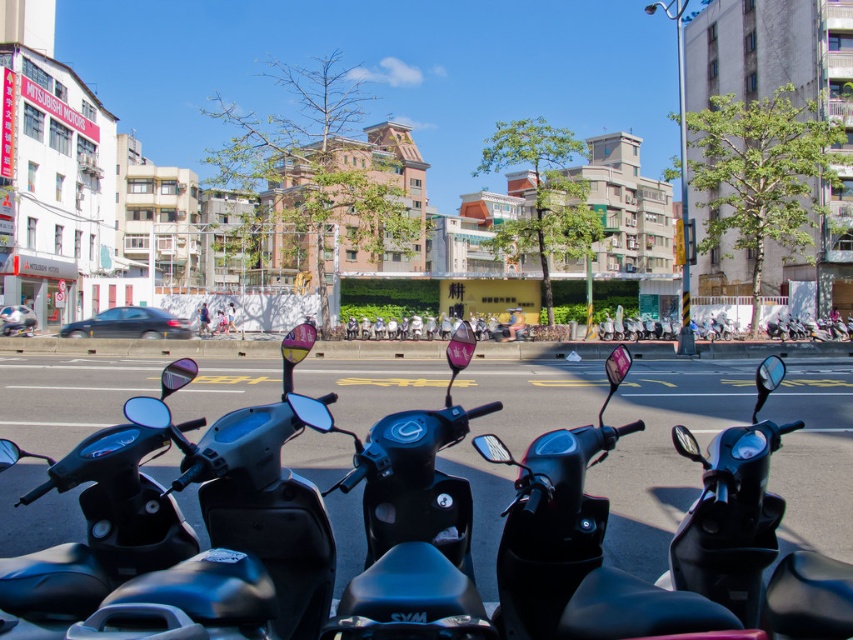
You are a delivery person needing to quickly access your vehicle. You see both the matte black motorbike at center and the black matte scooter at center. Which one is closer to you?

The matte black motorbike at center is closer to you because the black matte scooter at center is positioned behind it.

You are a delivery person who needs to park your vehicle between two scooters. You have a matte black motorbike at center and a black matte scooter at center in front of you. Which vehicle should you move to create space for your delivery van?

You should move the black matte scooter at center to the right of the matte black motorbike at center since the matte black motorbike at center is already positioned to the left of it, creating space between them.